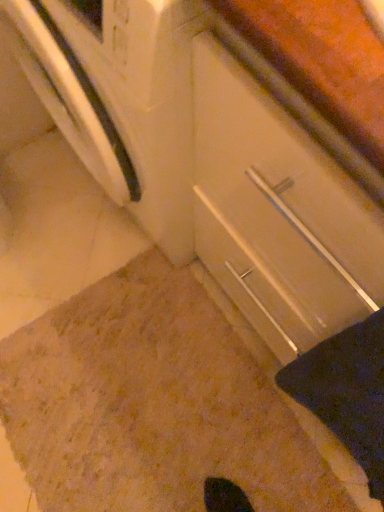
Question: Is point (347, 400) closer or farther from the camera than point (258, 480)?

Choices:
 (A) closer
 (B) farther

Answer: (A)

Question: Looking at their shapes, would you say black fabric at lower right is wider or thinner than brown textured carpet at lower center?

Choices:
 (A) wide
 (B) thin

Answer: (B)

Question: Based on their relative distances, which object is farther from the white glossy drawer at center?

Choices:
 (A) black fabric at lower right
 (B) brown textured carpet at lower center

Answer: (B)

Question: Which object is the farthest from the black fabric at lower right?

Choices:
 (A) brown textured carpet at lower center
 (B) white glossy drawer at center

Answer: (A)